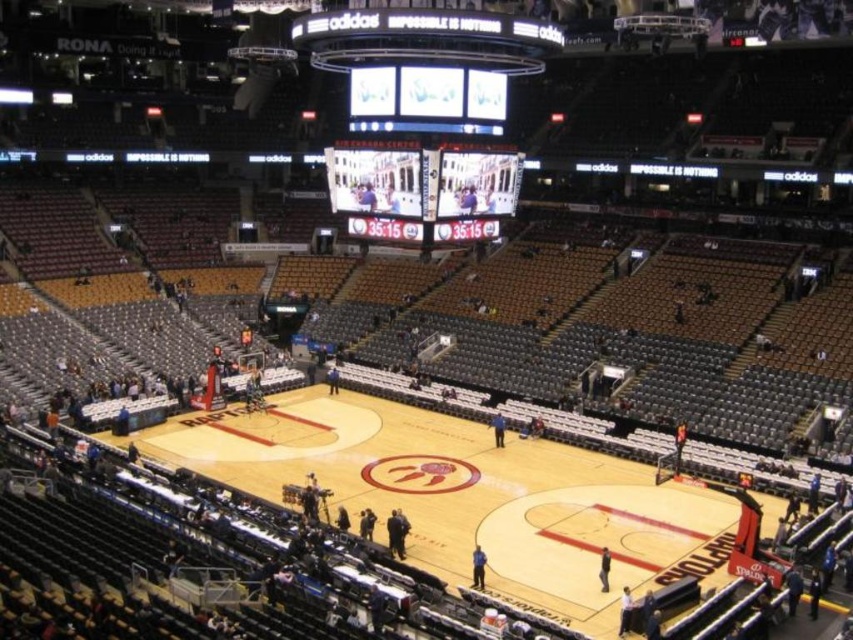
You are a photographer standing at the entrance of the arena. You want to take a photo of the wooden basketball court at center. Considering the distance, is it possible to capture the entire court in a single frame without moving the camera?

The wooden basketball court at center is 96.42 feet away from the camera. Since standard camera lenses can capture a wide field of view, it is possible to capture the entire court in a single frame without moving the camera, provided the lens has sufficient zoom or wide angle capability.

You are a photographer positioned at the entrance of the arena. You want to capture a photo that includes both the wooden basketball court at center and the led display at center. Based on their positions, which object should you frame first to ensure both are in the shot?

The wooden basketball court at center is positioned on the left side of the led display at center, so you should frame the wooden basketball court at center first to ensure both are in the shot.